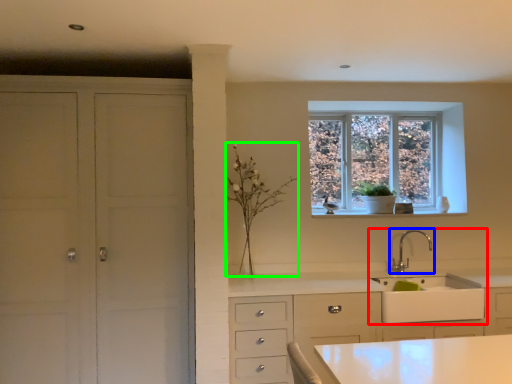
Question: Which object is the farthest from sink (highlighted by a red box)? Choose among these: tap (highlighted by a blue box) or plant (highlighted by a green box).

Choices:
 (A) tap
 (B) plant

Answer: (B)